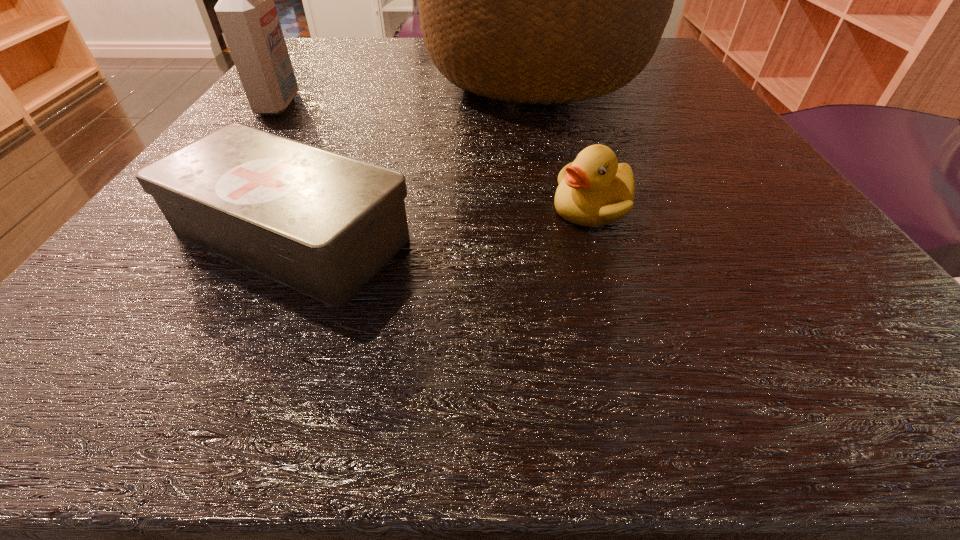
Locate an element on the screen. basket is located at coordinates (545, 0).

Locate an element on the screen. Image resolution: width=960 pixels, height=540 pixels. cleansing agent is located at coordinates (247, 14).

This screenshot has width=960, height=540. I want to click on duckling, so click(594, 190).

This screenshot has width=960, height=540. I want to click on the first-aid kit, so click(x=324, y=224).

The image size is (960, 540). I want to click on vacant space located on the front of the basket, so click(x=582, y=315).

You are a GUI agent. You are given a task and a screenshot of the screen. Output one action in this format:
    pyautogui.click(x=<x>, y=<y>)
    Task: Click on the free space located on the front label of the cleansing agent
    This screenshot has height=540, width=960.
    Given the screenshot: What is the action you would take?
    pyautogui.click(x=462, y=104)

Identify the location of free location located 0.190m on the beak of the duckling. The width and height of the screenshot is (960, 540). (399, 207).

At what (x,y) coordinates should I click in order to perform the action: click on vacant area situated 0.350m on the beak of the duckling. Please return your answer as a coordinate pair (x, y). This screenshot has width=960, height=540. Looking at the image, I should click on (271, 207).

Where is `vacant space located on the beak of the duckling`? The image size is (960, 540). vacant space located on the beak of the duckling is located at coordinates (504, 207).

At what (x,y) coordinates should I click in order to perform the action: click on vacant area situated on the right of the first-aid kit. Please return your answer as a coordinate pair (x, y). Looking at the image, I should click on (683, 235).